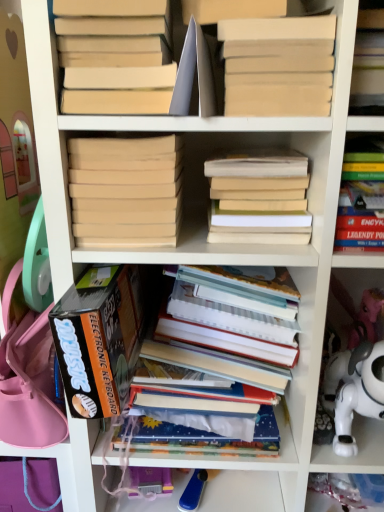
Where is `light brown matte book at center, placed as the 2th book when sorted from right to left`? Image resolution: width=384 pixels, height=512 pixels. light brown matte book at center, placed as the 2th book when sorted from right to left is located at coordinates (259, 197).

What is the approximate width of black cardboard box at lower left, placed as the 1th book when sorted from left to right?

black cardboard box at lower left, placed as the 1th book when sorted from left to right, is 36.30 centimeters wide.

Image resolution: width=384 pixels, height=512 pixels. I want to click on matte beige book at upper left, placed as the 3th book when sorted from left to right, so click(115, 56).

This screenshot has height=512, width=384. What are the coordinates of `hardcover books at center, which is counted as the 4th book, starting from the left` in the screenshot? It's located at (204, 371).

Is black cardboard box at lower left, which is the 7th book in right-to-left order, positioned with its back to hardcover book at upper right, the 7th book positioned from the left?

No, black cardboard box at lower left, which is the 7th book in right-to-left order, is not facing the opposite direction of hardcover book at upper right, the 7th book positioned from the left.

From the image's perspective, is black cardboard box at lower left, placed as the 1th book when sorted from left to right, below hardcover book at upper right, positioned as the first book in right-to-left order?

Indeed, from the image's perspective, black cardboard box at lower left, placed as the 1th book when sorted from left to right, is shown beneath hardcover book at upper right, positioned as the first book in right-to-left order.

In the image, is black cardboard box at lower left, which is the 7th book in right-to-left order, positioned in front of or behind hardcover book at upper right, positioned as the first book in right-to-left order?

black cardboard box at lower left, which is the 7th book in right-to-left order, is positioned closer to the viewer than hardcover book at upper right, positioned as the first book in right-to-left order.

Is black cardboard box at lower left, placed as the 1th book when sorted from left to right, not close to hardcover book at upper right, positioned as the first book in right-to-left order?

Actually, black cardboard box at lower left, placed as the 1th book when sorted from left to right, and hardcover book at upper right, positioned as the first book in right-to-left order, are a little close together.

Can you tell me how much hardcover book at upper right, the 7th book positioned from the left, and beige matte book at center, which is the second book from left to right, differ in facing direction?

2.15 degrees separate the facing orientations of hardcover book at upper right, the 7th book positioned from the left, and beige matte book at center, which is the second book from left to right.

Is hardcover book at upper right, positioned as the first book in right-to-left order, turned away from beige matte book at center, which is the second book from left to right?

No.

From the image's perspective, which book is the 1st one above the hardcover book at upper right, positioned as the first book in right-to-left order? Please provide its 2D coordinates.

[(126, 191)]

Which is in front, point (374, 220) or point (137, 229)?

The point (374, 220) is closer to the camera.

This screenshot has width=384, height=512. There is a matte beige book at upper left, placed as the 3th book when sorted from left to right. Find the location of `the 3rd book below it (from the image's perspective)`. the 3rd book below it (from the image's perspective) is located at coordinates (361, 196).

Does hardcover book at upper right, the 7th book positioned from the left, have a lesser height compared to matte beige book at upper left, placed as the 3th book when sorted from left to right?

Yes, hardcover book at upper right, the 7th book positioned from the left, is shorter than matte beige book at upper left, placed as the 3th book when sorted from left to right.

Is hardcover book at upper right, positioned as the first book in right-to-left order, next to matte beige book at upper left, which is counted as the 5th book, starting from the right, and touching it?

hardcover book at upper right, positioned as the first book in right-to-left order, and matte beige book at upper left, which is counted as the 5th book, starting from the right, are clearly separated.

Do you think white plastic toy at lower right is within hardcover book at upper right, positioned as the first book in right-to-left order, or outside of it?

The correct answer is: outside.

Looking at this image, from the image's perspective, relative to hardcover book at upper right, the 7th book positioned from the left, is white plastic toy at lower right above or below?

white plastic toy at lower right is situated lower than hardcover book at upper right, the 7th book positioned from the left, in the image.

How different are the orientations of white plastic toy at lower right and hardcover book at upper right, positioned as the first book in right-to-left order, in degrees?

0.00125 degrees.

Is white plastic toy at lower right bigger or smaller than hardcover book at upper right, the 7th book positioned from the left?

Considering their sizes, white plastic toy at lower right takes up more space than hardcover book at upper right, the 7th book positioned from the left.

Looking at this image, is white plastic toy at lower right to the left of beige cardboard book at upper center, which is counted as the fifth book, starting from the left, from the viewer's perspective?

No, white plastic toy at lower right is not to the left of beige cardboard book at upper center, which is counted as the fifth book, starting from the left.

Which point is more forward, (x=360, y=457) or (x=320, y=24)?

The point (x=320, y=24) is closer to the camera.

Is white plastic toy at lower right facing towards beige cardboard book at upper center, which is counted as the fifth book, starting from the left?

No, white plastic toy at lower right is not facing towards beige cardboard book at upper center, which is counted as the fifth book, starting from the left.

From a real-world perspective, does hardcover book at upper right, the 7th book positioned from the left, sit lower than light brown matte book at center, placed as the 2th book when sorted from right to left?

No, from a real-world perspective, hardcover book at upper right, the 7th book positioned from the left, is not below light brown matte book at center, placed as the 2th book when sorted from right to left.

Where is `book that is the 1st one when counting downward from the hardcover book at upper right, positioned as the first book in right-to-left order (from the image's perspective)`? This screenshot has height=512, width=384. book that is the 1st one when counting downward from the hardcover book at upper right, positioned as the first book in right-to-left order (from the image's perspective) is located at coordinates (259, 197).

From the picture: Which is further, (383, 138) or (280, 170)?

Positioned behind is point (383, 138).

From the image's perspective, is hardcover book at upper right, the 7th book positioned from the left, located beneath light brown matte book at center, which is the 6th book from left to right?

Incorrect, from the image's perspective, hardcover book at upper right, the 7th book positioned from the left, is higher than light brown matte book at center, which is the 6th book from left to right.

Is hardcover books at center, which is counted as the fourth book, starting from the right, positioned in front of beige matte book at center, which is counted as the 6th book, starting from the right?

No, hardcover books at center, which is counted as the fourth book, starting from the right, is further to the viewer.

Is hardcover books at center, which is counted as the 4th book, starting from the left, looking in the opposite direction of beige matte book at center, which is counted as the 6th book, starting from the right?

No.

Is hardcover books at center, which is counted as the 4th book, starting from the left, shorter than beige matte book at center, which is the second book from left to right?

No, hardcover books at center, which is counted as the 4th book, starting from the left, is not shorter than beige matte book at center, which is the second book from left to right.

Looking at this image, would you say hardcover books at center, which is counted as the fourth book, starting from the right, is to the left or to the right of beige matte book at center, which is counted as the 6th book, starting from the right, in the picture?

From the image, it's evident that hardcover books at center, which is counted as the fourth book, starting from the right, is to the right of beige matte book at center, which is counted as the 6th book, starting from the right.

Which book is the 1st one when counting from the front of the hardcover book at upper right, the 7th book positioned from the left? Please provide its 2D coordinates.

[(99, 339)]

This screenshot has width=384, height=512. Identify the location of the 1st book below when counting from the beige matte book at center, which is the second book from left to right (from the image's perspective). [x=361, y=196].

In the scene shown: Estimate the real-world distances between objects in this image. Which object is further from white plastic toy at lower right, black cardboard box at lower left, which is the 7th book in right-to-left order, or matte beige book at upper left, which is counted as the 5th book, starting from the right?

The object further to white plastic toy at lower right is matte beige book at upper left, which is counted as the 5th book, starting from the right.

When comparing their distances from white plastic toy at lower right, does black cardboard box at lower left, placed as the 1th book when sorted from left to right, or light brown matte book at center, placed as the 2th book when sorted from right to left, seem closer?

black cardboard box at lower left, placed as the 1th book when sorted from left to right, is closer to white plastic toy at lower right.

When comparing their distances from white plastic toy at lower right, does hardcover book at upper right, the 7th book positioned from the left, or hardcover books at center, which is counted as the 4th book, starting from the left, seem closer?

hardcover books at center, which is counted as the 4th book, starting from the left, is closer to white plastic toy at lower right.

Considering their positions, is beige matte book at center, which is the second book from left to right, positioned closer to hardcover books at center, which is counted as the fourth book, starting from the right, than hardcover book at upper right, the 7th book positioned from the left?

beige matte book at center, which is the second book from left to right, is closer to hardcover books at center, which is counted as the fourth book, starting from the right.

When comparing their distances from hardcover books at center, which is counted as the 4th book, starting from the left, does beige matte book at center, which is counted as the 6th book, starting from the right, or white plastic toy at lower right seem further?

The object further to hardcover books at center, which is counted as the 4th book, starting from the left, is beige matte book at center, which is counted as the 6th book, starting from the right.

From the image, which object appears to be nearer to black cardboard box at lower left, placed as the 1th book when sorted from left to right, light brown matte book at center, placed as the 2th book when sorted from right to left, or hardcover book at upper right, the 7th book positioned from the left?

light brown matte book at center, placed as the 2th book when sorted from right to left, is closer to black cardboard box at lower left, placed as the 1th book when sorted from left to right.

Which object lies nearer to the anchor point hardcover book at upper right, positioned as the first book in right-to-left order, hardcover books at center, which is counted as the fourth book, starting from the right, or white plastic toy at lower right?

hardcover books at center, which is counted as the fourth book, starting from the right, lies closer to hardcover book at upper right, positioned as the first book in right-to-left order, than the other object.

Estimate the real-world distances between objects in this image. Which object is further from matte beige book at upper left, which is counted as the 5th book, starting from the right, beige cardboard book at upper center, which is counted as the fifth book, starting from the left, or white plastic toy at lower right?

white plastic toy at lower right.

Find the location of a particular element. The width and height of the screenshot is (384, 512). book between light brown matte book at center, which is the 6th book from left to right, and hardcover books at center, which is counted as the 4th book, starting from the left, in the up-down direction is located at coordinates point(99,339).

You are a GUI agent. You are given a task and a screenshot of the screen. Output one action in this format:
    pyautogui.click(x=<x>, y=<y>)
    Task: Click on the book located between beige cardboard book at upper center, which is counted as the fifth book, starting from the left, and hardcover book at upper right, the 7th book positioned from the left, in the left-right direction
    This screenshot has height=512, width=384.
    Given the screenshot: What is the action you would take?
    pyautogui.click(x=259, y=197)